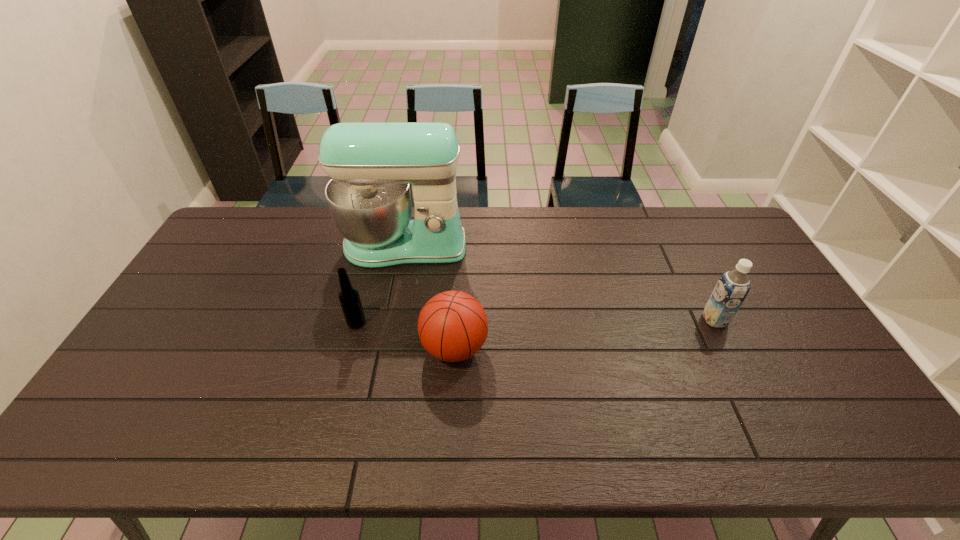
Identify the location of vacant area that lies between the beer bottle and the rightmost object. (536, 321).

Locate an element on the screen. free space between the soya milk and the mixer is located at coordinates (560, 283).

Locate an element on the screen. The height and width of the screenshot is (540, 960). unoccupied area between the basketball and the soya milk is located at coordinates (585, 334).

At what (x,y) coordinates should I click in order to perform the action: click on free space between the beer bottle and the soya milk. Please return your answer as a coordinate pair (x, y). This screenshot has width=960, height=540. Looking at the image, I should click on (536, 321).

The height and width of the screenshot is (540, 960). In order to click on vacant region between the tallest object and the soya milk in this screenshot , I will do `click(560, 283)`.

Locate an element on the screen. vacant area between the basketball and the beer bottle is located at coordinates (405, 335).

Where is `vacant point located between the beer bottle and the soya milk`? vacant point located between the beer bottle and the soya milk is located at coordinates (536, 321).

Locate an element on the screen. This screenshot has width=960, height=540. empty space that is in between the tallest object and the soya milk is located at coordinates click(x=560, y=283).

Identify which object is located as the second nearest to the soya milk. Please provide its 2D coordinates. Your answer should be formatted as a tuple, i.e. [(x, y)], where the tuple contains the x and y coordinates of a point satisfying the conditions above.

[(371, 165)]

Locate which object ranks second in proximity to the basketball. Please provide its 2D coordinates. Your answer should be formatted as a tuple, i.e. [(x, y)], where the tuple contains the x and y coordinates of a point satisfying the conditions above.

[(371, 165)]